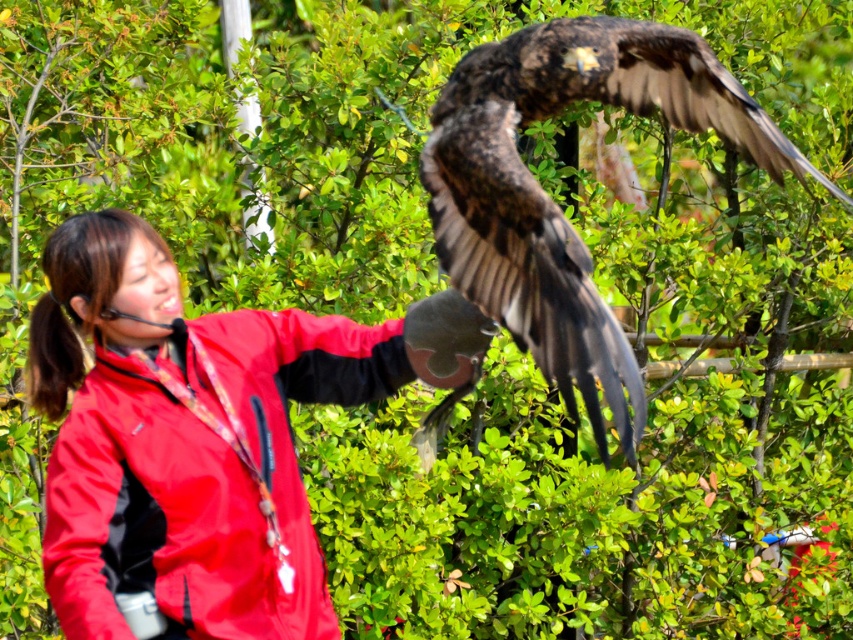
Question: Is the position of matte red jacket at center less distant than that of dark brown feathers at upper center?

Choices:
 (A) yes
 (B) no

Answer: (B)

Question: Is matte red jacket at center wider than dark brown feathers at upper center?

Choices:
 (A) yes
 (B) no

Answer: (A)

Question: Which object appears farthest from the camera in this image?

Choices:
 (A) dark brown feathers at upper center
 (B) matte red jacket at center

Answer: (B)

Question: Which object is farther from the camera taking this photo?

Choices:
 (A) dark brown feathers at upper center
 (B) matte red jacket at center

Answer: (B)

Question: Can you confirm if matte red jacket at center is positioned to the left of dark brown feathers at upper center?

Choices:
 (A) no
 (B) yes

Answer: (B)

Question: Which point appears closest to the camera in this image?

Choices:
 (A) (589, 410)
 (B) (131, 374)

Answer: (A)